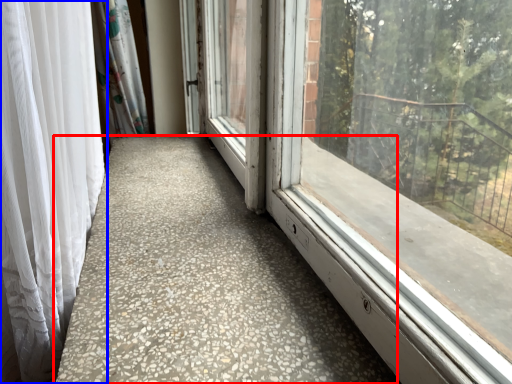
Question: Which object appears farthest to the camera in this image, concrete (highlighted by a red box) or curtain (highlighted by a blue box)?

Choices:
 (A) concrete
 (B) curtain

Answer: (A)